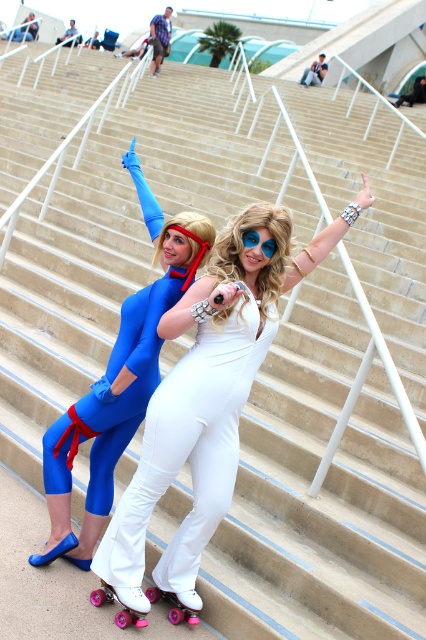
You are standing at the bottom of the stairs where the two people are. You want to walk towards the point marked by the coordinates point (160, 38). Which direction should you go relative to the two people?

The point marked by coordinates point (160, 38) is located to the left of the two people, so you should walk towards the left relative to their position.

You are a photographer standing on the stairs. You want to capture a photo where the brushed metal water at bottle left and the matte blue jumpsuit at center are both clearly visible. Based on their positions, will the water bottle block the view of the jumpsuit?

The brushed metal water at bottle left is positioned over the matte blue jumpsuit at center, so the water bottle will block the view of the matte blue jumpsuit at center in the photo.

You are a photographer standing at the base of the stairs. You want to capture a photo that includes both the person in the blue bodysuit and the brushed metal water at bottle left. Since the bottle is 18.15 meters away, will you need to adjust your camera settings to focus on both subjects simultaneously?

The brushed metal water at bottle left is 18.15 meters from the camera. To capture both the person in the blue bodysuit and the bottle in focus, the photographer should use a smaller aperture to increase depth of field, ensuring both subjects are sharp.